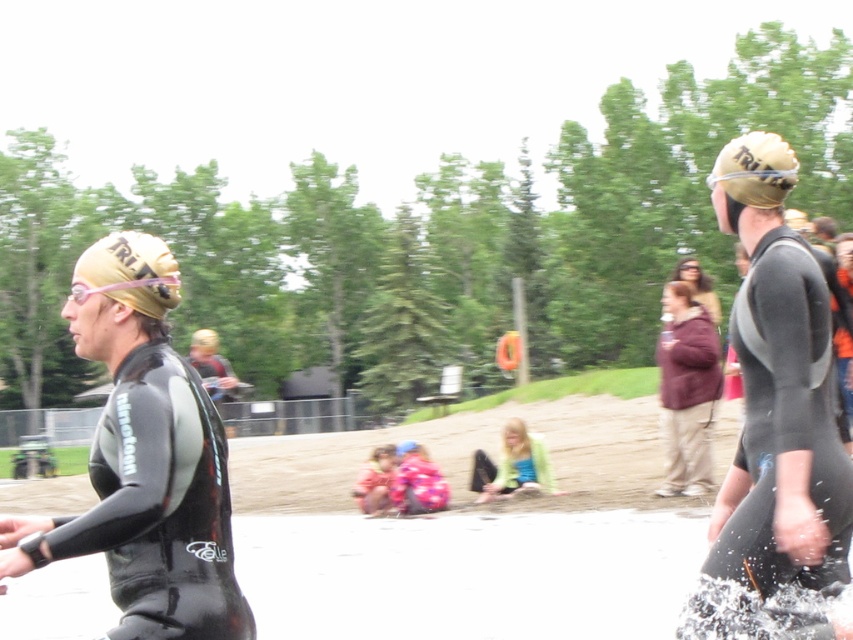
Question: Can you confirm if black matte wetsuit at left is positioned above matte gold helmet at upper center?

Choices:
 (A) no
 (B) yes

Answer: (A)

Question: Is matte black wetsuit at right below maroon fleece jacket at center?

Choices:
 (A) yes
 (B) no

Answer: (B)

Question: Among these points, which one is nearest to the camera?

Choices:
 (A) (714, 371)
 (B) (680, 280)
 (C) (508, 468)

Answer: (A)

Question: Is black matte wetsuit at left smaller than maroon fleece jacket at center?

Choices:
 (A) no
 (B) yes

Answer: (A)

Question: Which point appears closest to the camera in this image?

Choices:
 (A) (698, 397)
 (B) (805, 554)
 (C) (497, 481)
 (D) (201, 536)

Answer: (D)

Question: Which is farther from the maroon fleece jacket at center?

Choices:
 (A) matte black wetsuit at right
 (B) matte gold helmet at upper center
 (C) matte green jacket at center
 (D) black matte wetsuit at left

Answer: (D)